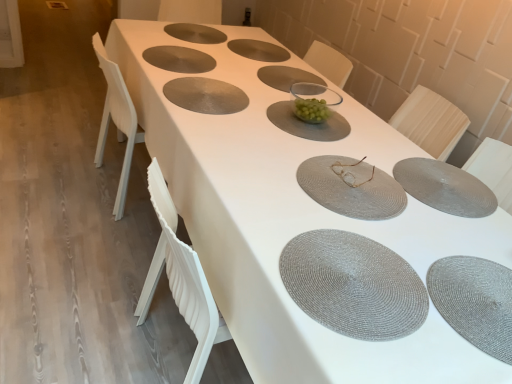
Locate an element on the screen. vacant area that lies between matte gray placemat at center, which is counted as the third tableware, starting from the bottom, and clear glass bowl at center, arranged as the 6th tableware when ordered from the bottom is located at coordinates (313, 137).